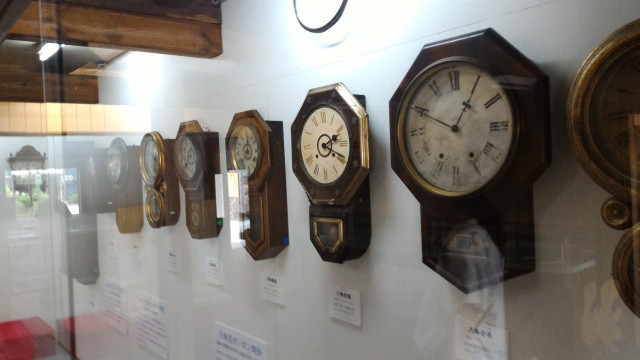
You are a GUI agent. You are given a task and a screenshot of the screen. Output one action in this format:
    pyautogui.click(x=<x>, y=<y>)
    Task: Click on the clock face
    The height and width of the screenshot is (360, 640).
    Given the screenshot: What is the action you would take?
    pyautogui.click(x=32, y=174), pyautogui.click(x=114, y=164), pyautogui.click(x=153, y=157), pyautogui.click(x=187, y=159), pyautogui.click(x=239, y=154), pyautogui.click(x=323, y=144), pyautogui.click(x=456, y=130), pyautogui.click(x=618, y=108)